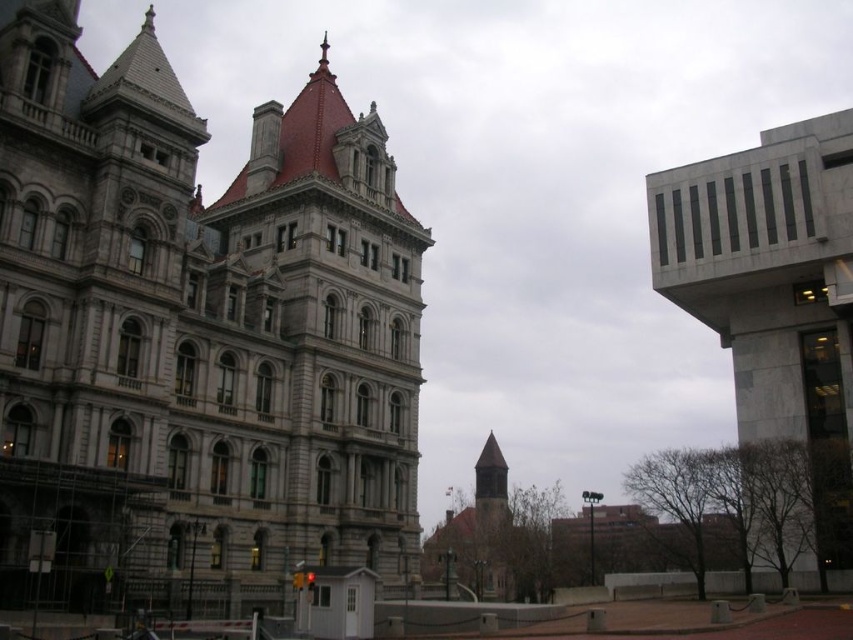
Question: Is gray stone tower at center bigger than gray marble tower at right?

Choices:
 (A) no
 (B) yes

Answer: (A)

Question: Which point is farther from the camera taking this photo?

Choices:
 (A) (352, 250)
 (B) (824, 124)

Answer: (B)

Question: Can you confirm if gray stone tower at center is positioned above gray marble tower at right?

Choices:
 (A) no
 (B) yes

Answer: (A)

Question: Which point is farther to the camera?

Choices:
 (A) (788, 304)
 (B) (294, 481)

Answer: (A)

Question: Observing the image, what is the correct spatial positioning of gray stone tower at center in reference to gray marble tower at right?

Choices:
 (A) left
 (B) right

Answer: (A)